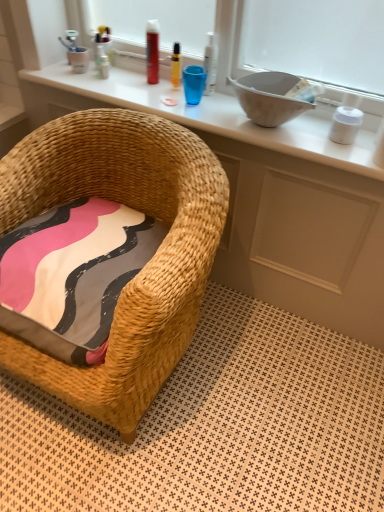
The image size is (384, 512). Find the location of `unoccupied area in front of shiny red can at upper center, the second toiletry viewed from the left`. unoccupied area in front of shiny red can at upper center, the second toiletry viewed from the left is located at coordinates (153, 95).